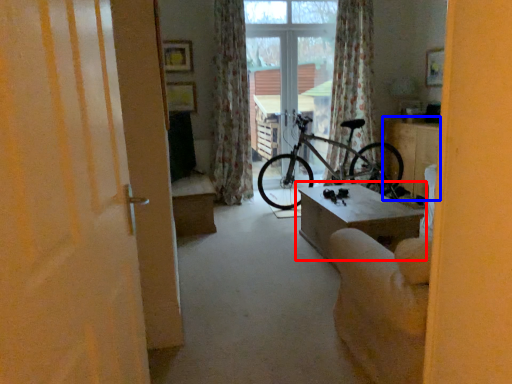
Question: Which of the following is the farthest to the observer, table (highlighted by a red box) or table (highlighted by a blue box)?

Choices:
 (A) table
 (B) table

Answer: (B)